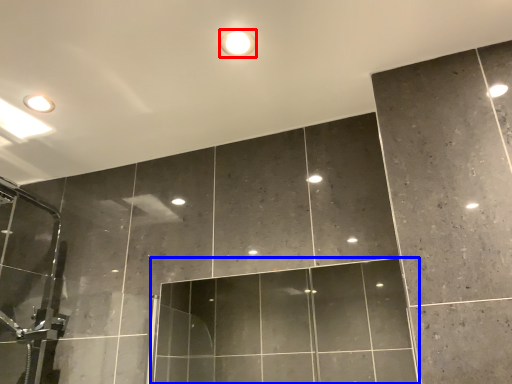
Question: Which object appears farthest to the camera in this image, droplight (highlighted by a red box) or glass door (highlighted by a blue box)?

Choices:
 (A) droplight
 (B) glass door

Answer: (A)